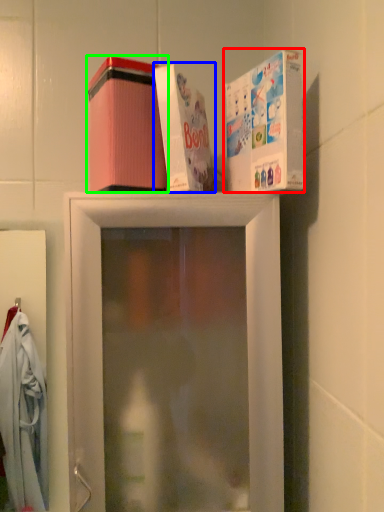
Question: Which object is positioned farthest from box (highlighted by a red box)? Select from box (highlighted by a blue box) and box (highlighted by a green box).

Choices:
 (A) box
 (B) box

Answer: (B)